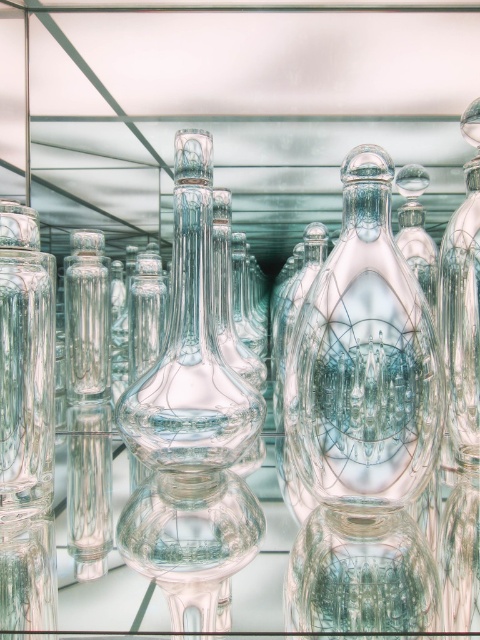
Question: Which object is closer to the camera taking this photo?

Choices:
 (A) transparent glass vase at center
 (B) transparent glass bottle at right

Answer: (A)

Question: Is transparent glass vase at center positioned at the back of transparent glass bottle at right?

Choices:
 (A) yes
 (B) no

Answer: (B)

Question: Which of the following is the farthest from the observer?

Choices:
 (A) (467, 243)
 (B) (380, 387)

Answer: (A)

Question: Where is transparent glass vase at center located in relation to transparent glass bottle at right in the image?

Choices:
 (A) right
 (B) left

Answer: (B)

Question: Is transparent glass vase at center behind transparent glass bottle at right?

Choices:
 (A) yes
 (B) no

Answer: (B)

Question: Which of the following is the farthest from the observer?

Choices:
 (A) (469, 440)
 (B) (315, 412)

Answer: (A)